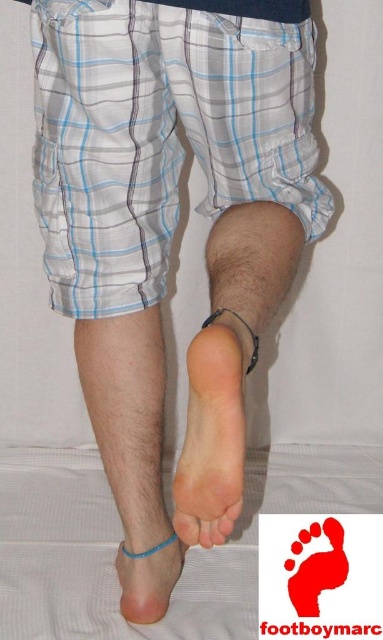
Is white plaid shorts at lower left shorter than transparent blue toe at lower center?

No, white plaid shorts at lower left is not shorter than transparent blue toe at lower center.

I want to click on white plaid shorts at lower left, so click(112, 250).

Who is positioned more to the right, matte black ankle at lower center or pink matte toe at center?

matte black ankle at lower center

Looking at this image, can you confirm if matte black ankle at lower center is smaller than pink matte toe at center?

No, matte black ankle at lower center is not smaller than pink matte toe at center.

Is point (219, 308) positioned after point (214, 529)?

Yes, point (219, 308) is behind point (214, 529).

I want to click on matte black ankle at lower center, so click(x=245, y=326).

Which is in front, point (180, 529) or point (224, 515)?

Point (224, 515)

Does transparent blue toe at lower center appear on the right side of pink matte toe at center?

Incorrect, transparent blue toe at lower center is not on the right side of pink matte toe at center.

This screenshot has height=640, width=383. I want to click on transparent blue toe at lower center, so click(186, 525).

At what (x,y) coordinates should I click in order to perform the action: click on transparent blue toe at lower center. Please return your answer as a coordinate pair (x, y). Looking at the image, I should click on (186, 525).